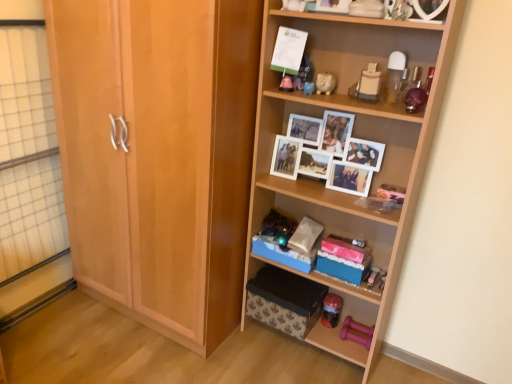
Question: Looking at their shapes, would you say white paper at upper center is wider or thinner than matte plastic toy at upper center, arranged as the 3th toy when viewed from the top?

Choices:
 (A) thin
 (B) wide

Answer: (A)

Question: In terms of height, does white paper at upper center look taller or shorter compared to matte plastic toy at upper center, arranged as the 3th toy when viewed from the top?

Choices:
 (A) tall
 (B) short

Answer: (A)

Question: Estimate the real-world distances between objects in this image. Which object is closer to the light brown wood cabinet at left?

Choices:
 (A) matte plastic toy at upper center, the 5th toy when ordered from bottom to top
 (B) white matte picture frame at upper center
 (C) matte pink piggy bank at upper center, which is counted as the 4th toy, starting from the top
 (D) translucent plastic jar at lower center, the sixth toy positioned from the top
 (E) white glossy piggy bank at upper center, the second toy viewed from the top

Answer: (C)

Question: Which object is positioned closest to the translucent plastic jar at lower center, placed as the 2th toy when sorted from bottom to top?

Choices:
 (A) pink rubber dumbbells at lower right, positioned as the 1th toy in bottom-to-top order
 (B) matte pink piggy bank at upper center, positioned as the fourth toy in bottom-to-top order
 (C) rubber pink dumbbell at lower right, the third toy positioned from the bottom
 (D) transparent glass door at left
 (E) matte plastic toy at upper center, the 5th toy when ordered from bottom to top

Answer: (A)